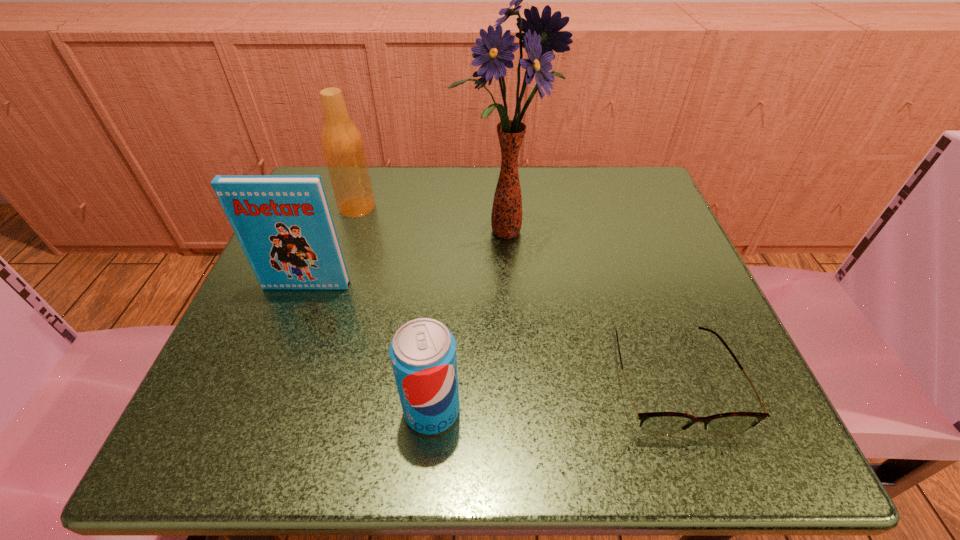
You are a GUI agent. You are given a task and a screenshot of the screen. Output one action in this format:
    pyautogui.click(x=<x>, y=<y>)
    Task: Click on the free space at the near edge
    
    Given the screenshot: What is the action you would take?
    pyautogui.click(x=575, y=396)

You are a GUI agent. You are given a task and a screenshot of the screen. Output one action in this format:
    pyautogui.click(x=<x>, y=<y>)
    Task: Click on the blank space at the left edge of the desktop
    The width and height of the screenshot is (960, 540).
    Given the screenshot: What is the action you would take?
    pyautogui.click(x=299, y=295)

Find the location of a particular element. This screenshot has width=960, height=540. vacant area at the right edge is located at coordinates (666, 293).

I want to click on vacant region at the far right corner, so click(x=639, y=210).

Image resolution: width=960 pixels, height=540 pixels. Find the location of `free spot between the spectacles and the book`. free spot between the spectacles and the book is located at coordinates (489, 333).

Where is `empty location between the tallest object and the book`? The image size is (960, 540). empty location between the tallest object and the book is located at coordinates (405, 259).

This screenshot has width=960, height=540. In order to click on free space between the rightmost object and the beer bottle in this screenshot , I will do `click(514, 294)`.

Image resolution: width=960 pixels, height=540 pixels. Identify the location of empty space that is in between the rightmost object and the flower arrangement. (587, 306).

Where is `free space between the shortest object and the third nearest object`? This screenshot has width=960, height=540. free space between the shortest object and the third nearest object is located at coordinates (489, 333).

Identify the location of free spot between the rightmost object and the flower arrangement. The image size is (960, 540). (587, 306).